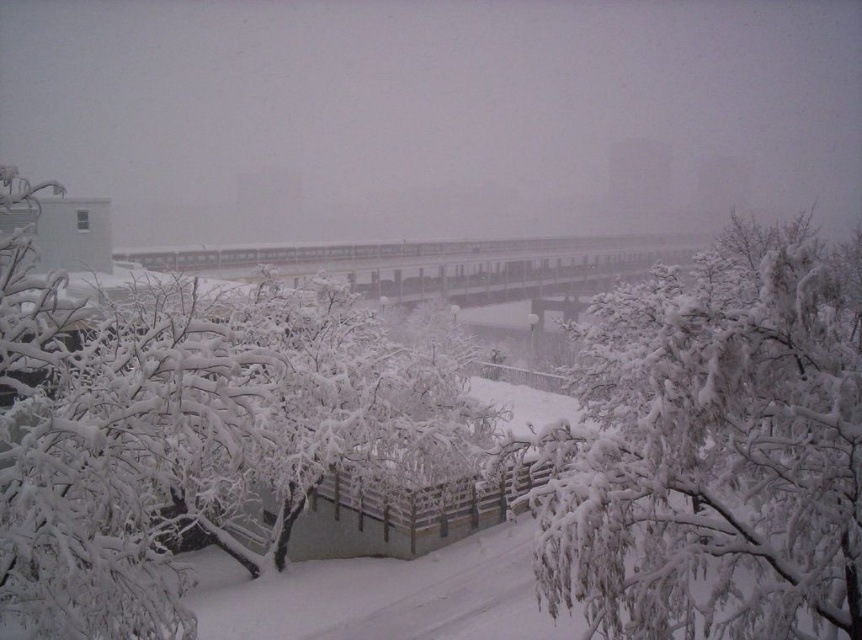
You are standing at the origin point of the coordinate system in the winter scene. You want to walk towards the white frosty tree at center. Which direction should you move in?

The white frosty tree at center is located at coordinate point 0.681 on the x axis and 0.218 on the y axis. Since you are at the origin, you should move towards the positive x and positive y directions to reach it.

You are standing at the point closer to the camera between the two points, point (4, 204) and point (828, 272). Which point are you standing at?

You are standing at point (4, 204) because it is further to the camera than point (828, 272).

You are standing at the center of the snowy pathway in the winter scene. You notice a point marked at coordinates (186, 435). What object is located at that point?

The point at coordinates (186, 435) corresponds to the white frosty tree at center.